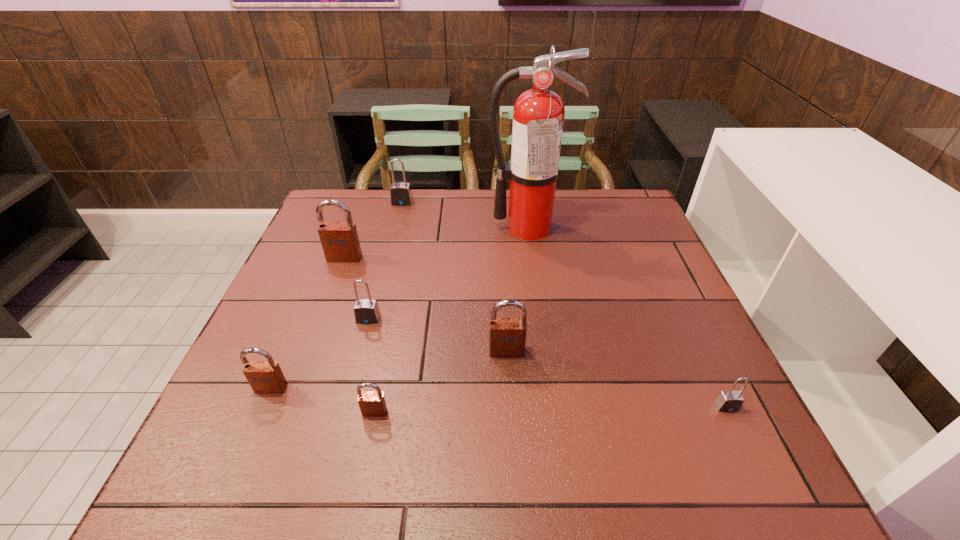
Where is `free space between the biggest brown padlock and the fifth farthest padlock`? The width and height of the screenshot is (960, 540). free space between the biggest brown padlock and the fifth farthest padlock is located at coordinates (308, 323).

At what (x,y) coordinates should I click in order to perform the action: click on blank region between the second farthest object and the farthest gray padlock. Please return your answer as a coordinate pair (x, y). Looking at the image, I should click on (465, 215).

Identify which object is located as the sixth nearest to the third nearest padlock. Please provide its 2D coordinates. Your answer should be formatted as a tuple, i.e. [(x, y)], where the tuple contains the x and y coordinates of a point satisfying the conditions above.

[(400, 193)]

Locate which object ranks fourth in proximity to the third nearest object. Please provide its 2D coordinates. Your answer should be formatted as a tuple, i.e. [(x, y)], where the tuple contains the x and y coordinates of a point satisfying the conditions above.

[(507, 336)]

Identify which padlock is the third nearest to the second biggest brown padlock. Please provide its 2D coordinates. Your answer should be formatted as a tuple, i.e. [(x, y)], where the tuple contains the x and y coordinates of a point satisfying the conditions above.

[(729, 401)]

The width and height of the screenshot is (960, 540). What are the coordinates of `padlock that is the second closest to the sixth padlock from left to right` in the screenshot? It's located at (366, 311).

Point out which brown padlock is positioned as the nearest to the smallest brown padlock. Please provide its 2D coordinates. Your answer should be formatted as a tuple, i.e. [(x, y)], where the tuple contains the x and y coordinates of a point satisfying the conditions above.

[(265, 377)]

Image resolution: width=960 pixels, height=540 pixels. What are the coordinates of `the second closest brown padlock to the sixth farthest object` in the screenshot? It's located at (340, 242).

Image resolution: width=960 pixels, height=540 pixels. I want to click on gray padlock that is the third closest to the red fire extinguisher, so click(x=729, y=401).

Locate which gray padlock is the second closest to the red fire extinguisher. Please provide its 2D coordinates. Your answer should be formatted as a tuple, i.e. [(x, y)], where the tuple contains the x and y coordinates of a point satisfying the conditions above.

[(366, 311)]